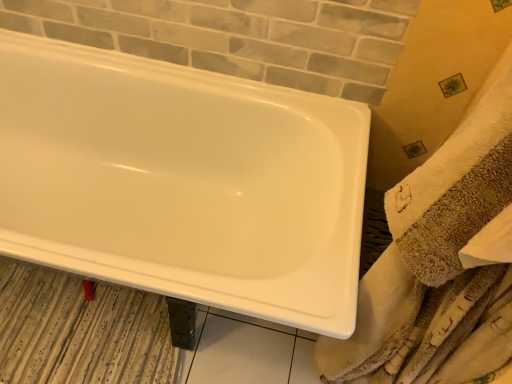
Question: Can you confirm if striped fabric bath mat at lower left is positioned to the right of beige textured towel at right?

Choices:
 (A) yes
 (B) no

Answer: (B)

Question: Considering the relative sizes of striped fabric bath mat at lower left and beige textured towel at right in the image provided, is striped fabric bath mat at lower left shorter than beige textured towel at right?

Choices:
 (A) no
 (B) yes

Answer: (B)

Question: Is striped fabric bath mat at lower left in front of beige textured towel at right?

Choices:
 (A) no
 (B) yes

Answer: (A)

Question: Does striped fabric bath mat at lower left have a smaller size compared to beige textured towel at right?

Choices:
 (A) no
 (B) yes

Answer: (B)

Question: Is striped fabric bath mat at lower left facing towards beige textured towel at right?

Choices:
 (A) yes
 (B) no

Answer: (B)

Question: From their relative heights in the image, would you say white glossy bathtub at upper left is taller or shorter than striped fabric bath mat at lower left?

Choices:
 (A) short
 (B) tall

Answer: (B)

Question: Is point (287, 309) closer or farther from the camera than point (128, 354)?

Choices:
 (A) farther
 (B) closer

Answer: (B)

Question: From the image's perspective, is white glossy bathtub at upper left positioned above or below striped fabric bath mat at lower left?

Choices:
 (A) above
 (B) below

Answer: (A)

Question: Looking at the image, does white glossy bathtub at upper left seem bigger or smaller compared to striped fabric bath mat at lower left?

Choices:
 (A) big
 (B) small

Answer: (A)

Question: From the image's perspective, is beige textured towel at right positioned above or below white glossy bathtub at upper left?

Choices:
 (A) above
 (B) below

Answer: (B)

Question: Is beige textured towel at right inside or outside of white glossy bathtub at upper left?

Choices:
 (A) outside
 (B) inside

Answer: (A)

Question: Is beige textured towel at right taller or shorter than white glossy bathtub at upper left?

Choices:
 (A) tall
 (B) short

Answer: (A)

Question: Considering the positions of beige textured towel at right and white glossy bathtub at upper left in the image, is beige textured towel at right bigger or smaller than white glossy bathtub at upper left?

Choices:
 (A) small
 (B) big

Answer: (A)

Question: From the image's perspective, is striped fabric bath mat at lower left positioned above or below white glossy bathtub at upper left?

Choices:
 (A) below
 (B) above

Answer: (A)

Question: Is point (20, 322) closer or farther from the camera than point (150, 289)?

Choices:
 (A) farther
 (B) closer

Answer: (A)